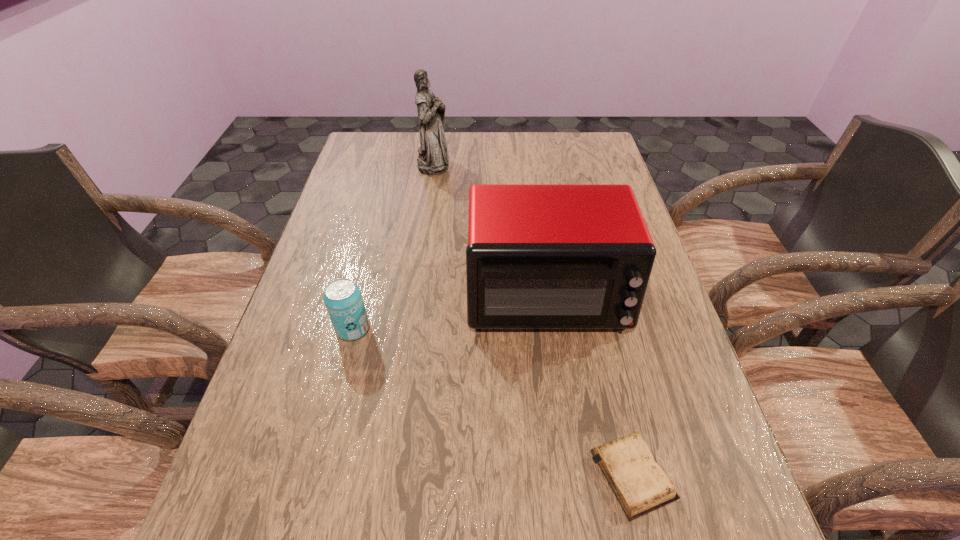
Identify the location of free point that satisfies the following two spatial constraints: 1. on the front-facing side of the nearest object; 2. on the left side of the second tallest object. (570, 474).

Find the location of a particular element. blank space that satisfies the following two spatial constraints: 1. on the front-facing side of the diary; 2. on the left side of the third shortest object is located at coordinates (570, 474).

You are a GUI agent. You are given a task and a screenshot of the screen. Output one action in this format:
    pyautogui.click(x=<x>, y=<y>)
    Task: Click on the vacant region that satisfies the following two spatial constraints: 1. on the front-facing side of the toaster oven; 2. on the left side of the nearest object
    This screenshot has width=960, height=540.
    Given the screenshot: What is the action you would take?
    (x=570, y=474)